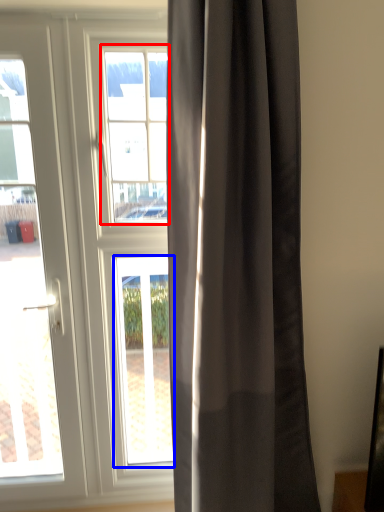
Question: Which of the following is the farthest to the observer, bay window (highlighted by a red box) or window (highlighted by a blue box)?

Choices:
 (A) bay window
 (B) window

Answer: (B)